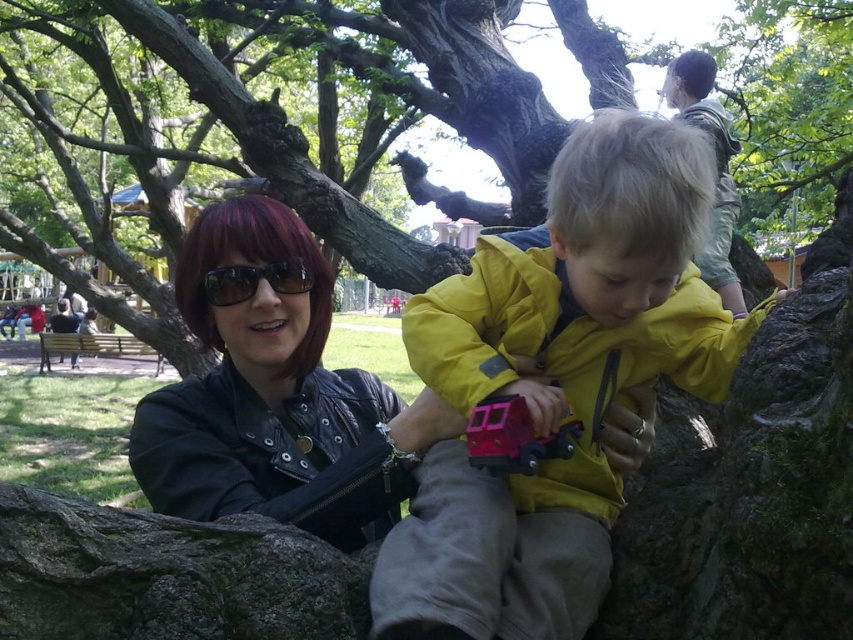
Can you confirm if yellow matte jacket at center is positioned above black plastic sunglasses at upper center?

Actually, yellow matte jacket at center is below black plastic sunglasses at upper center.

Consider the image. Does yellow matte jacket at center appear under black plastic sunglasses at upper center?

Yes.

Measure the distance between point (740, 344) and camera.

A distance of 37.53 inches exists between point (740, 344) and camera.

Find the location of a particular element. This screenshot has width=853, height=640. yellow matte jacket at center is located at coordinates tap(555, 381).

This screenshot has height=640, width=853. What do you see at coordinates (555, 381) in the screenshot? I see `yellow matte jacket at center` at bounding box center [555, 381].

Can you confirm if yellow matte jacket at center is positioned to the right of black leather jacket at center?

Yes, yellow matte jacket at center is to the right of black leather jacket at center.

What do you see at coordinates (555, 381) in the screenshot? I see `yellow matte jacket at center` at bounding box center [555, 381].

The width and height of the screenshot is (853, 640). In order to click on yellow matte jacket at center in this screenshot , I will do `click(555, 381)`.

Is the position of black leather jacket at center less distant than that of light brown fabric jacket at upper right?

Yes, it is.

This screenshot has height=640, width=853. What do you see at coordinates (273, 452) in the screenshot?
I see `black leather jacket at center` at bounding box center [273, 452].

Identify the location of black leather jacket at center. Image resolution: width=853 pixels, height=640 pixels. (273, 452).